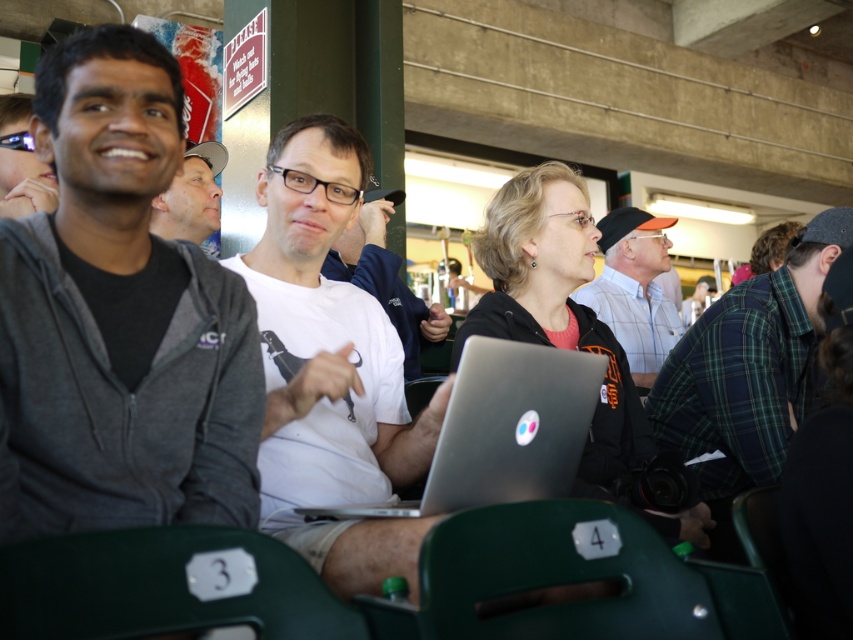
Based on the photo, can you confirm if white matte t-shirt at center is bigger than silver metallic laptop at center?

Yes, white matte t-shirt at center is bigger than silver metallic laptop at center.

Is white matte t-shirt at center wider than silver metallic laptop at center?

In fact, white matte t-shirt at center might be narrower than silver metallic laptop at center.

Who is more forward, (x=374, y=442) or (x=463, y=413)?

Point (x=463, y=413) is in front.

I want to click on white matte t-shirt at center, so click(329, 369).

What do you see at coordinates (747, 365) in the screenshot?
I see `green plaid shirt at right` at bounding box center [747, 365].

Is point (715, 499) closer to viewer compared to point (22, 156)?

No, it is behind (22, 156).

At what (x,y) coordinates should I click in order to perform the action: click on green plaid shirt at right. Please return your answer as a coordinate pair (x, y). Looking at the image, I should click on 747,365.

Does white matte t-shirt at center have a lesser height compared to matte white shirt at center?

In fact, white matte t-shirt at center may be taller than matte white shirt at center.

Does white matte t-shirt at center have a greater width compared to matte white shirt at center?

Correct, the width of white matte t-shirt at center exceeds that of matte white shirt at center.

The image size is (853, 640). I want to click on white matte t-shirt at center, so click(x=329, y=369).